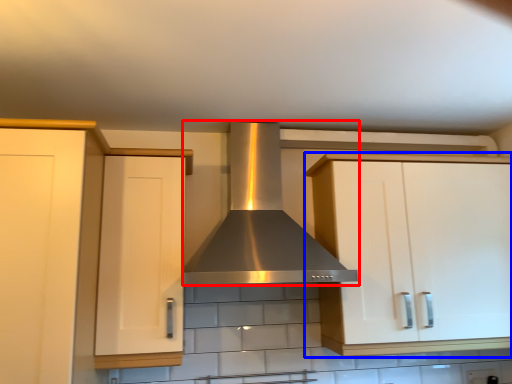
Question: Among these objects, which one is farthest to the camera, home appliance (highlighted by a red box) or cabinetry (highlighted by a blue box)?

Choices:
 (A) home appliance
 (B) cabinetry

Answer: (B)